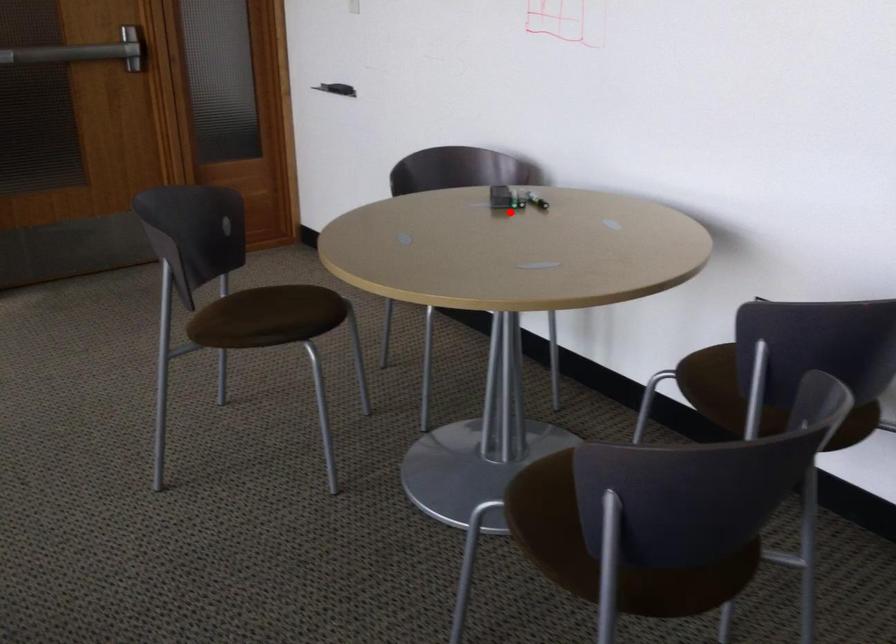
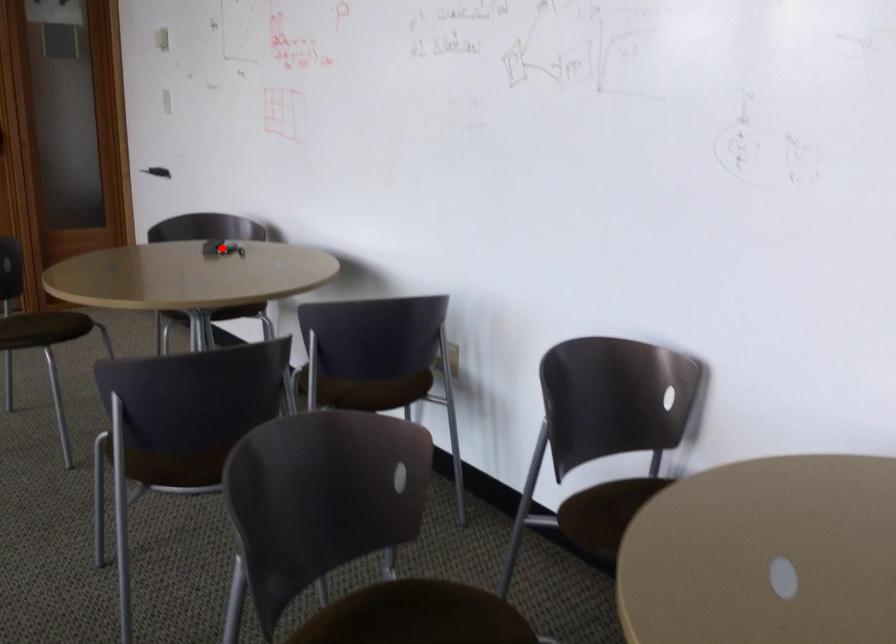
I am providing you with two images of the same scene from different viewpoints. A red point is marked on the first image and another point is marked on the second image. Does the point marked in image1 correspond to the same location as the one in image2?

Yes